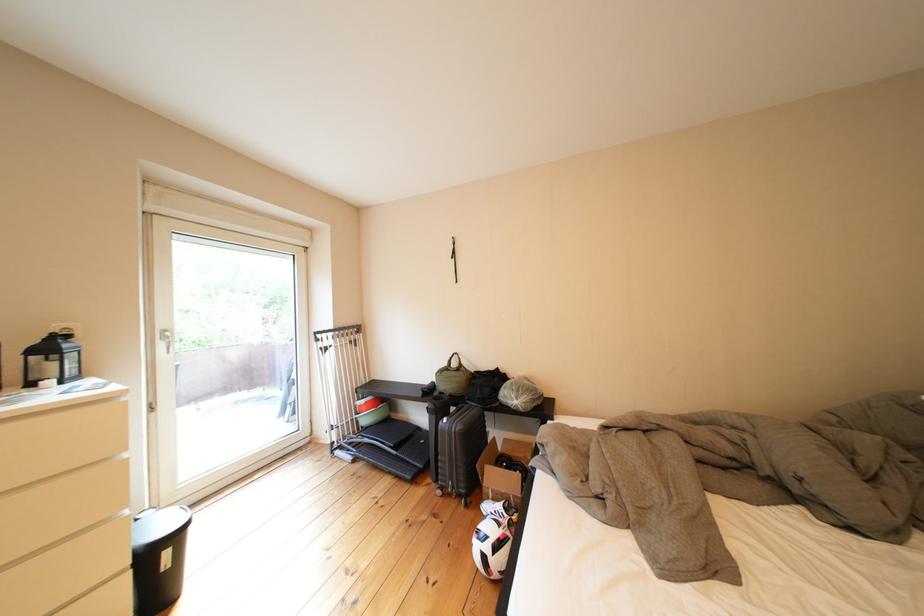
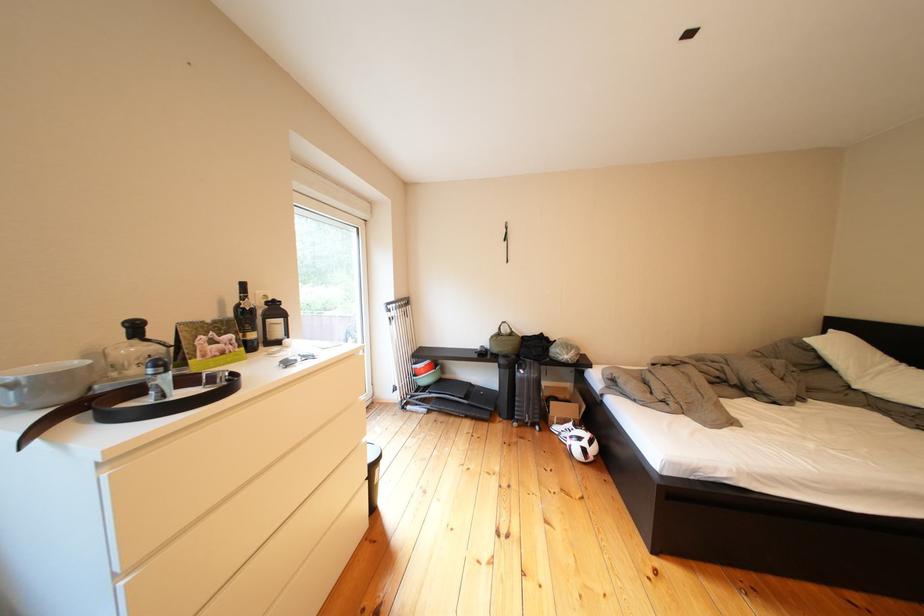
Locate, in the second image, the point that corresponds to pixel 500 511 in the first image.

(570, 432)